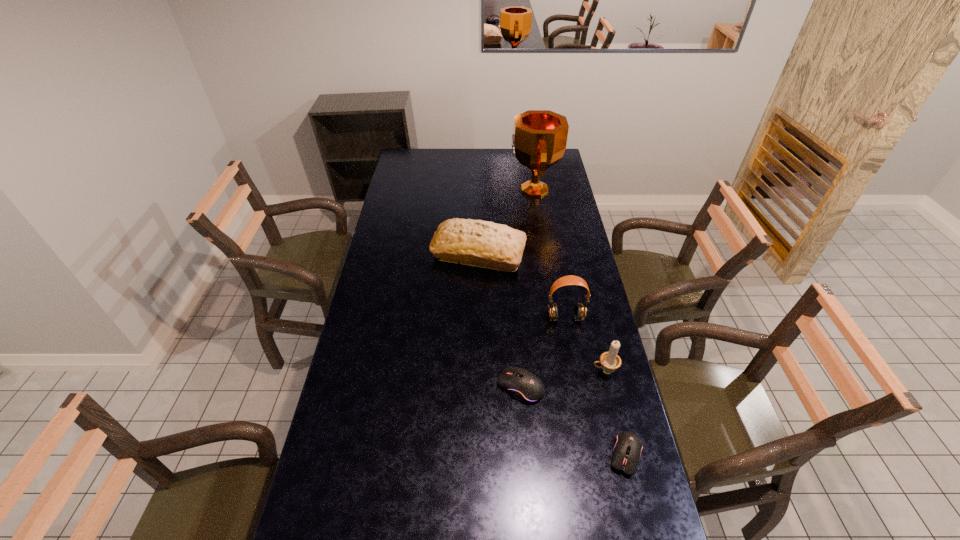
Find the location of `object that is at the far edge`. object that is at the far edge is located at coordinates (539, 138).

Identify the location of computer mouse at the right edge. (627, 448).

Where is `award at the right edge`? This screenshot has width=960, height=540. award at the right edge is located at coordinates (539, 138).

Image resolution: width=960 pixels, height=540 pixels. I want to click on headset that is at the right edge, so click(580, 309).

Image resolution: width=960 pixels, height=540 pixels. Identify the location of candle_holder that is at the right edge. (610, 361).

This screenshot has width=960, height=540. Find the location of `object at the far right corner`. object at the far right corner is located at coordinates (539, 138).

Find the location of a particular element. free space at the far edge is located at coordinates (511, 168).

The width and height of the screenshot is (960, 540). Identify the location of vacant space at the left edge. (408, 245).

In the image, there is a desktop. Find the location of `free region at the right edge`. free region at the right edge is located at coordinates (566, 356).

Locate an element on the screen. The image size is (960, 540). vacant area at the far left corner of the desktop is located at coordinates click(x=396, y=167).